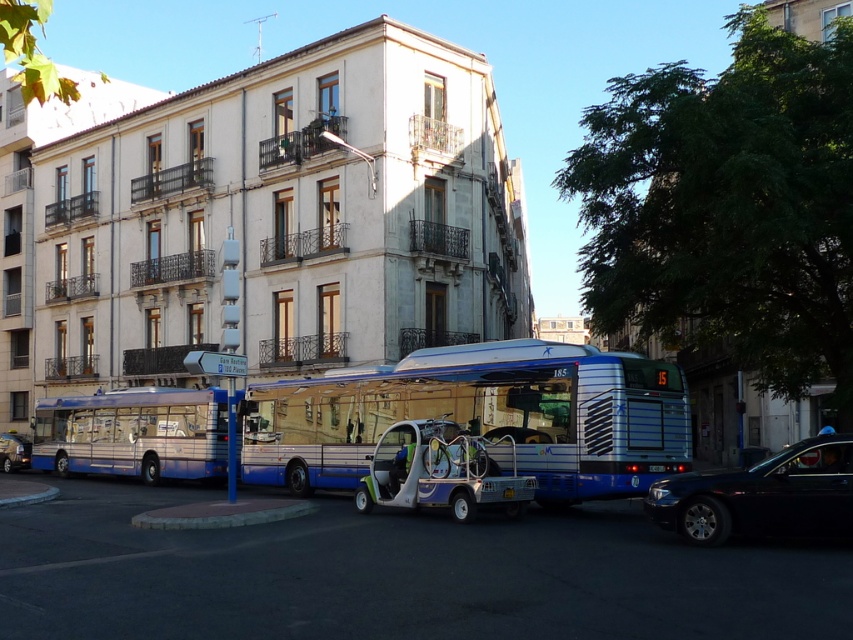
Question: Based on their relative distances, which object is nearer to the blue metallic bus at center?

Choices:
 (A) metallic silver car at lower left
 (B) metallic blue utility vehicle at center

Answer: (B)

Question: Which point appears farthest from the camera in this image?

Choices:
 (A) (643, 476)
 (B) (659, 500)

Answer: (A)

Question: Among these points, which one is farthest from the camera?

Choices:
 (A) (526, 486)
 (B) (788, 499)
 (C) (532, 465)
 (D) (3, 433)

Answer: (D)

Question: Is blue metallic bus at center thinner than metallic blue utility vehicle at center?

Choices:
 (A) yes
 (B) no

Answer: (B)

Question: Can you confirm if blue metallic bus at center is smaller than metallic silver car at lower left?

Choices:
 (A) no
 (B) yes

Answer: (A)

Question: Can you confirm if blue metallic bus at center is positioned above metallic blue bus at center?

Choices:
 (A) yes
 (B) no

Answer: (A)